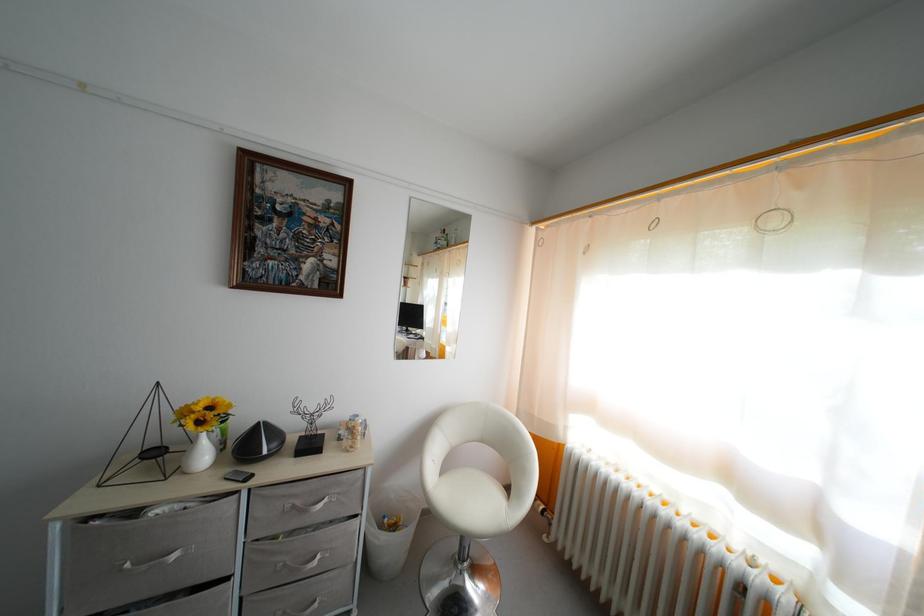
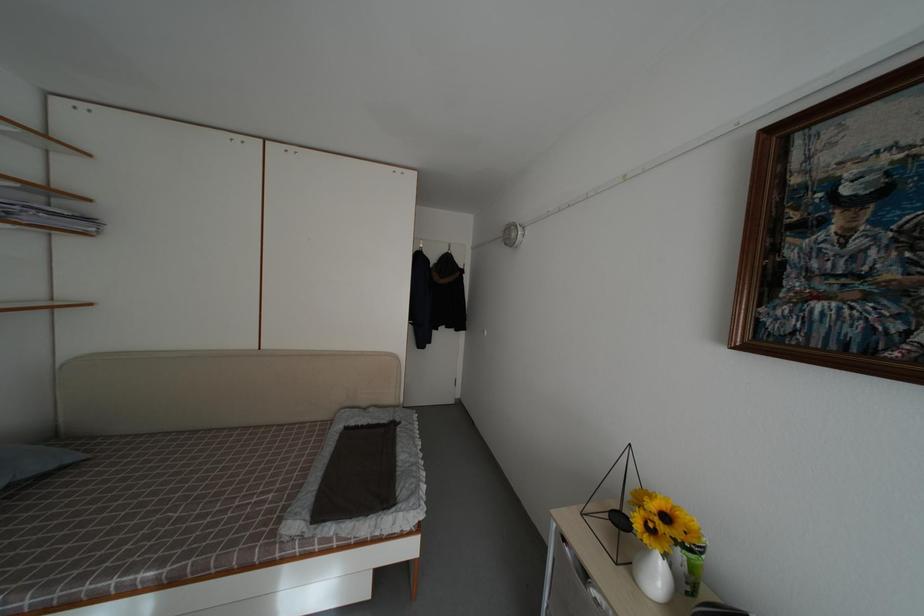
Question: The camera is either moving clockwise (left) or counter-clockwise (right) around the object. The first image is from the beginning of the video and the second image is from the end. Is the camera moving left or right when shooting the video?

Choices:
 (A) Left
 (B) Right

Answer: (B)